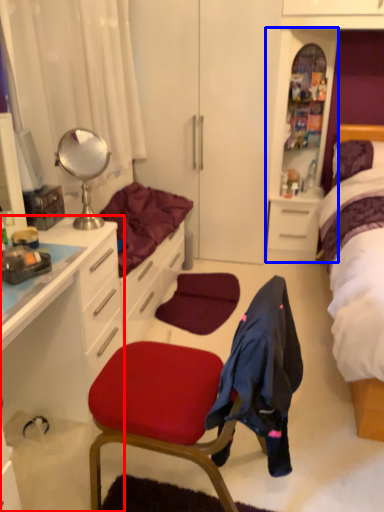
Question: Which of the following is the farthest to the observer, cabinetry (highlighted by a red box) or file cabinet (highlighted by a blue box)?

Choices:
 (A) cabinetry
 (B) file cabinet

Answer: (B)